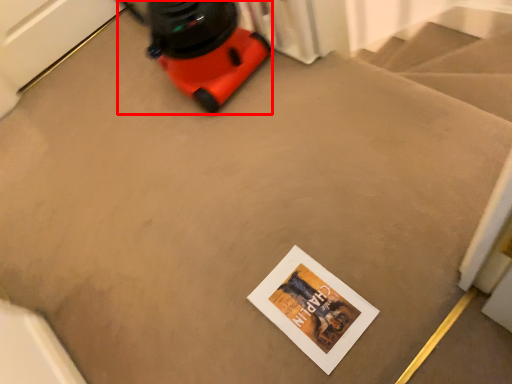
Question: From the image's perspective, what is the correct spatial relationship of equipment (annotated by the red box) in relation to postcard?

Choices:
 (A) above
 (B) below

Answer: (A)